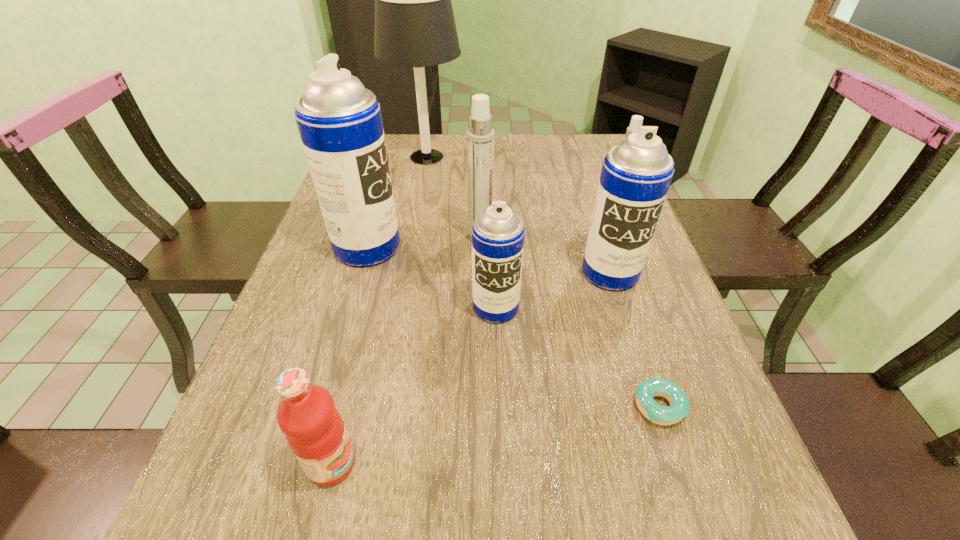
At what (x,y) coordinates should I click in order to perform the action: click on the farthest object. Please return your answer as a coordinate pair (x, y). The width and height of the screenshot is (960, 540). Looking at the image, I should click on (415, 27).

Where is `the leftmost aerosol can`? Image resolution: width=960 pixels, height=540 pixels. the leftmost aerosol can is located at coordinates (339, 121).

You are a GUI agent. You are given a task and a screenshot of the screen. Output one action in this format:
    pyautogui.click(x=<x>, y=<y>)
    Task: Click on the biggest blue aerosol can
    Image resolution: width=960 pixels, height=540 pixels.
    Given the screenshot: What is the action you would take?
    pyautogui.click(x=339, y=121)

Identify the location of the bigger white aerosol can. (480, 136).

Where is `the left white aerosol can`? This screenshot has width=960, height=540. the left white aerosol can is located at coordinates (480, 136).

In order to click on the rightmost blue aerosol can in this screenshot , I will do `click(636, 174)`.

Find the location of `the smaller white aerosol can`. the smaller white aerosol can is located at coordinates (637, 120).

Identify the location of the right white aerosol can. This screenshot has height=540, width=960. (637, 120).

Identify the location of the second blue aerosol can from left to right. (498, 234).

Find the location of a particular element. The width and height of the screenshot is (960, 540). the seventh tallest object is located at coordinates (315, 431).